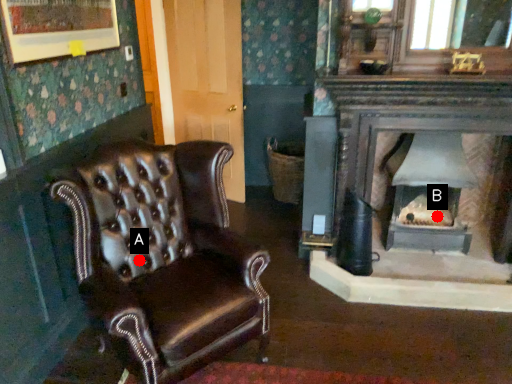
Question: Two points are circled on the image, labeled by A and B beside each circle. Which point is closer to the camera taking this photo?

Choices:
 (A) A is closer
 (B) B is closer

Answer: (A)